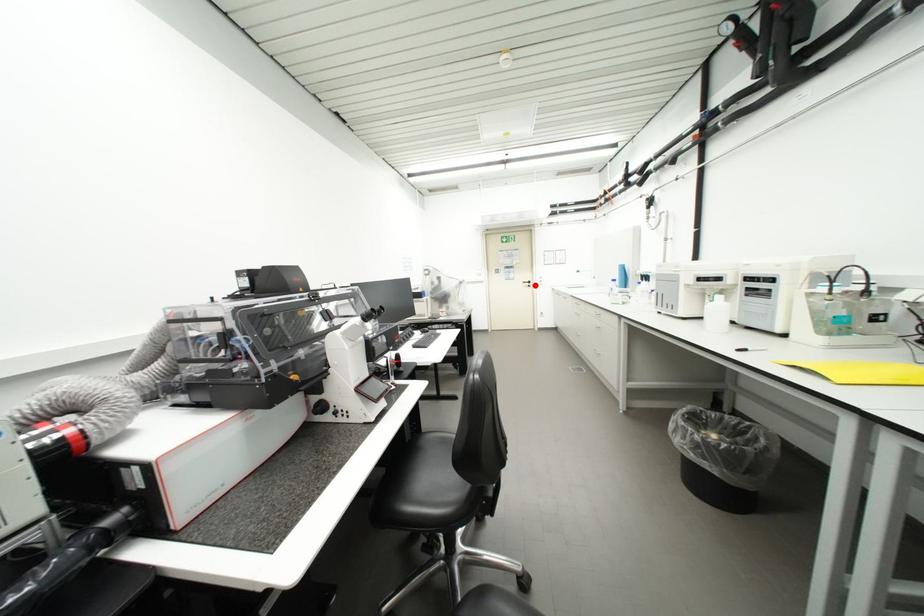
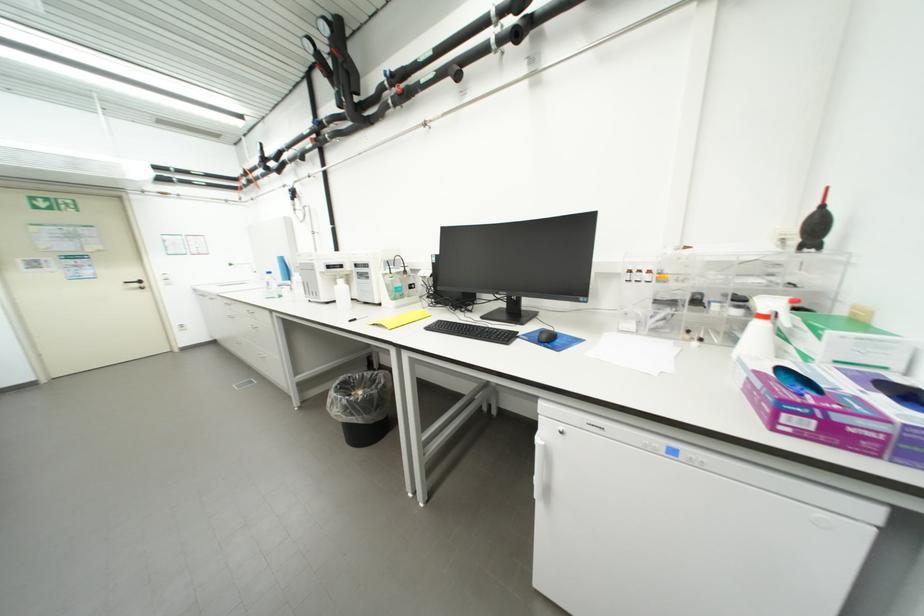
Find the pixel in the second image that matches the highlighted location in the first image.

(144, 286)